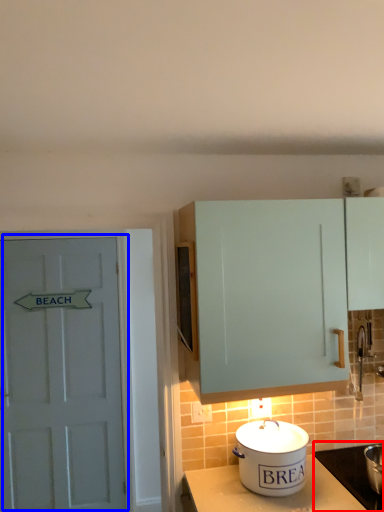
Question: Which object is further to the camera taking this photo, appliance (highlighted by a red box) or door (highlighted by a blue box)?

Choices:
 (A) appliance
 (B) door

Answer: (B)